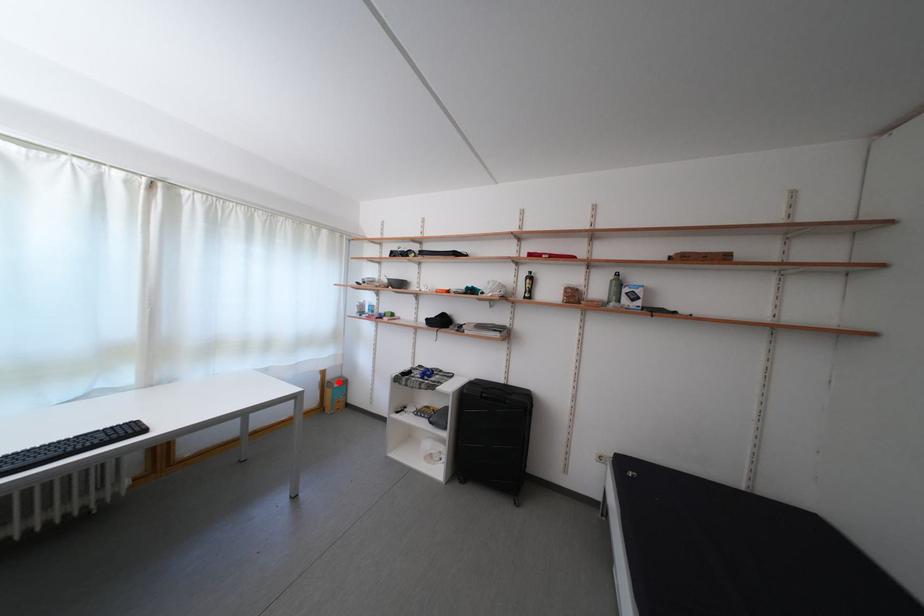
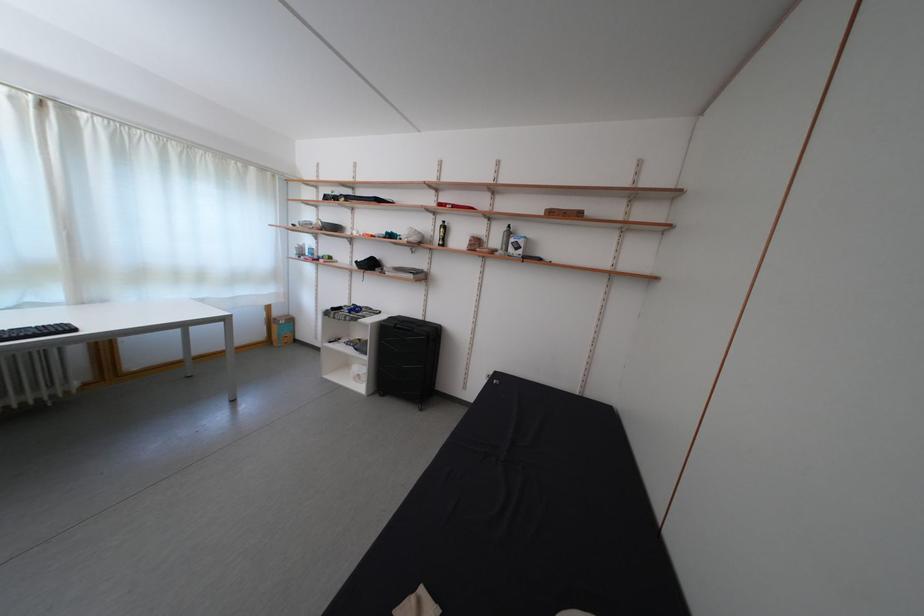
Question: I am providing you with two images of the same scene from different viewpoints. A red point is shown in image1. For the corresponding object point in image2, is it positioned nearer or farther from the camera?

Choices:
 (A) Nearer
 (B) Farther

Answer: (A)